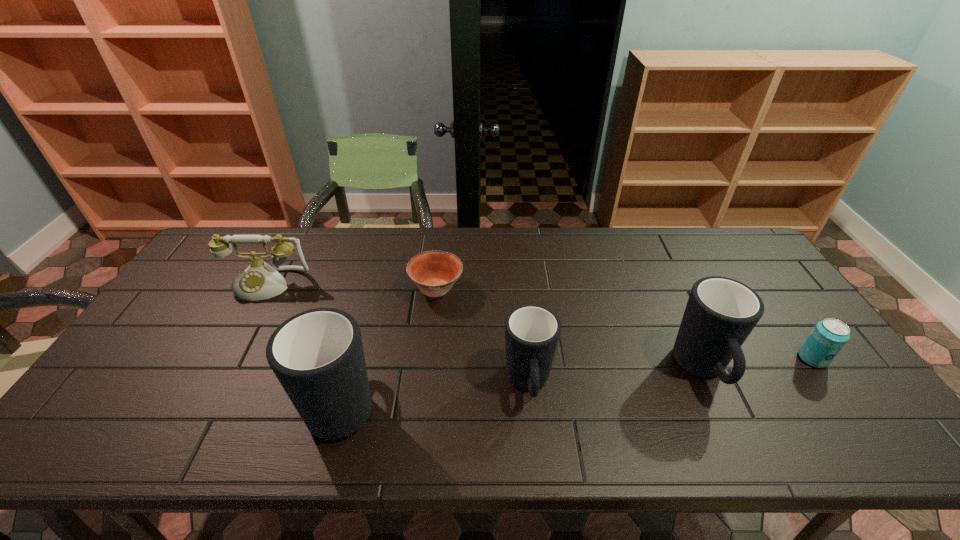
Find the location of a particular element. The width and height of the screenshot is (960, 540). vacant space located 0.060m on the side of the leftmost mug with the handle is located at coordinates (360, 339).

At what (x,y) coordinates should I click in order to perform the action: click on vacant region located 0.250m on the side of the leftmost mug with the handle. Please return your answer as a coordinate pair (x, y). Looking at the image, I should click on (372, 292).

The width and height of the screenshot is (960, 540). Identify the location of free space located 0.090m on the side of the leftmost mug with the handle. (363, 330).

Identify the location of vacant space situated on the dial of the telephone. (220, 373).

This screenshot has width=960, height=540. Identify the location of vacant space located 0.120m on the front of the bowl. (431, 339).

Identify the location of vacant area located on the back of the rightmost object. The height and width of the screenshot is (540, 960). (744, 264).

Identify the location of object present at the far edge. The width and height of the screenshot is (960, 540). (260, 281).

Where is `object situated at the left edge`? object situated at the left edge is located at coordinates (260, 281).

Locate an element on the screen. The height and width of the screenshot is (540, 960). object situated at the right edge is located at coordinates (828, 337).

You are a GUI agent. You are given a task and a screenshot of the screen. Output one action in this format:
    pyautogui.click(x=<x>, y=<y>)
    Task: Click on the object that is at the far left corner
    Image resolution: width=960 pixels, height=540 pixels.
    Given the screenshot: What is the action you would take?
    pyautogui.click(x=260, y=281)